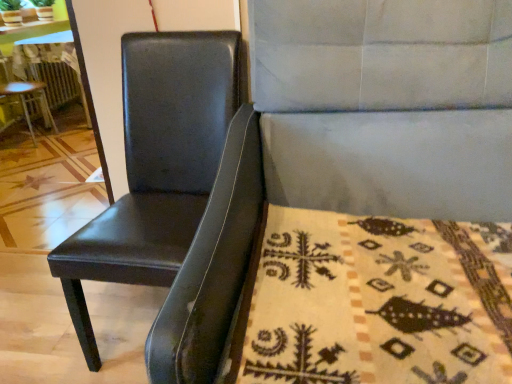
Question: Relative to black leather chair at left, which is counted as the 3th chair, starting from the right, is beige woolen blanket at lower right in front or behind?

Choices:
 (A) front
 (B) behind

Answer: (A)

Question: From a real-world perspective, is beige woolen blanket at lower right physically located above or below black leather chair at left, the 1th chair positioned from the left?

Choices:
 (A) above
 (B) below

Answer: (B)

Question: Which object is the farthest from the black leather chair at left, acting as the 1th chair starting from the front?

Choices:
 (A) beige woolen blanket at lower right
 (B) wooden table at left
 (C) black leather chair at left, which is the 3th chair from front to back
 (D) matte black chair at left, positioned as the second chair in front-to-back order

Answer: (B)

Question: Based on their relative distances, which object is nearer to the beige woolen blanket at lower right?

Choices:
 (A) black leather chair at left, which is the 3th chair from front to back
 (B) black leather chair at left, acting as the third chair starting from the left
 (C) wooden table at left
 (D) matte black chair at left, the 2th chair in the back-to-front sequence

Answer: (B)